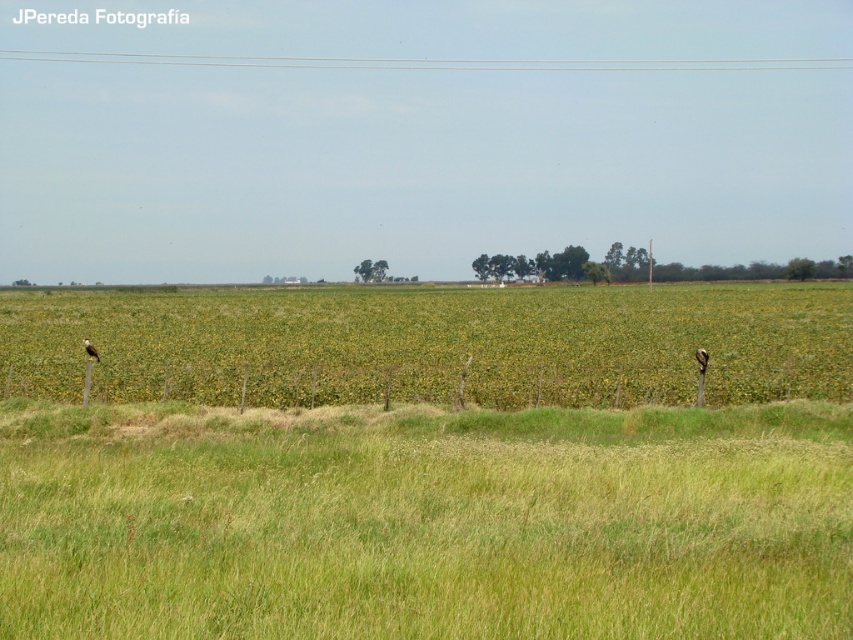
You are standing at the origin point of the image. Where is the green grassy field at lower center located?

The green grassy field at lower center is located at point (425, 522).

You are standing in the rural landscape and want to place a small marker at both point (x=769, y=424) and point (x=82, y=362). Which point will require you to walk further away from your current position to reach?

Point (x=82, y=362) requires walking further away from your current position because it is farther from the viewer compared to point (x=769, y=424).